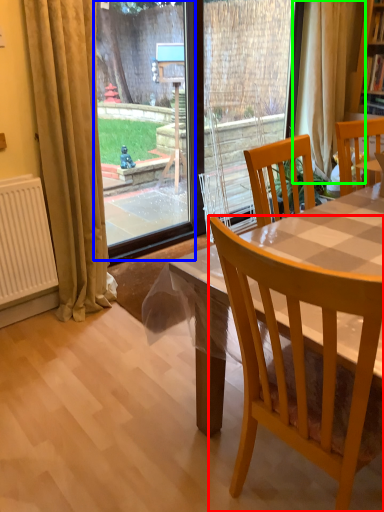
Question: Which is nearer to the chair (highlighted by a red box)? glass door (highlighted by a blue box) or curtain (highlighted by a green box).

Choices:
 (A) glass door
 (B) curtain

Answer: (B)